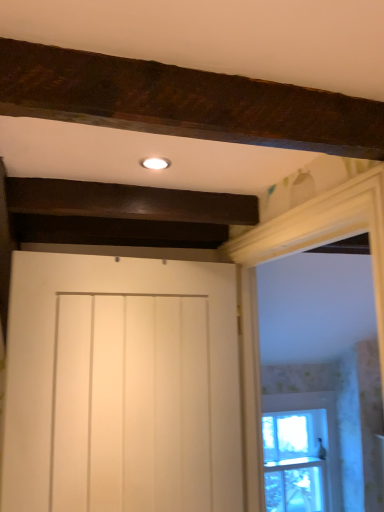
Find the location of `white matte door at center`. white matte door at center is located at coordinates (121, 385).

Where is `white wood frame at upper right`? white wood frame at upper right is located at coordinates (326, 231).

At what (x,y) coordinates should I click in order to perform the action: click on white matte door at center. Please return your answer as a coordinate pair (x, y). The width and height of the screenshot is (384, 512). Looking at the image, I should click on (121, 385).

Is clear glass window at right oriented towards white matte door at center?

No, clear glass window at right does not turn towards white matte door at center.

Does clear glass window at right touch white matte door at center?

No, clear glass window at right is not in contact with white matte door at center.

Is clear glass window at right positioned in front of white matte door at center?

No, it is behind white matte door at center.

Is clear glass window at right completely or partially outside of white wood frame at upper right?

Yes.

Can you confirm if clear glass window at right is taller than white wood frame at upper right?

No, clear glass window at right is not taller than white wood frame at upper right.

Is clear glass window at right wider than white wood frame at upper right?

No.

From the image's perspective, relative to clear glass window at right, is white wood frame at upper right above or below?

Based on their image positions, white wood frame at upper right is located above clear glass window at right.

Does white wood frame at upper right appear on the left side of clear glass window at right?

Yes, white wood frame at upper right is to the left of clear glass window at right.

Does point (305, 205) appear closer or farther from the camera than point (329, 402)?

Point (305, 205) is closer to the camera than point (329, 402).

Is the surface of white wood frame at upper right in direct contact with clear glass window at right?

No, white wood frame at upper right is not making contact with clear glass window at right.

Locate an element on the screen. window frame above the white matte door at center (from the image's perspective) is located at coordinates (326, 231).

Does white wood frame at upper right have a lesser height compared to white matte door at center?

Incorrect, the height of white wood frame at upper right does not fall short of that of white matte door at center.

Is white wood frame at upper right aimed at white matte door at center?

Yes.

Consider the image. Is white matte door at center directly adjacent to white wood frame at upper right?

No, white matte door at center is not in contact with white wood frame at upper right.

Does white matte door at center have a lesser height compared to white wood frame at upper right?

Correct, white matte door at center is not as tall as white wood frame at upper right.

Can you confirm if white matte door at center is thinner than white wood frame at upper right?

Indeed, white matte door at center has a lesser width compared to white wood frame at upper right.

Based on the photo, which is correct: white matte door at center is inside white wood frame at upper right, or outside of it?

The correct answer is: outside.

Which is more to the right, white matte door at center or clear glass window at right?

Positioned to the right is clear glass window at right.

From the image's perspective, is white matte door at center under clear glass window at right?

Actually, white matte door at center appears above clear glass window at right in the image.

Does white matte door at center lie behind clear glass window at right?

No, white matte door at center is in front of clear glass window at right.

Looking at this image, can we say white matte door at center lies outside clear glass window at right?

Yes, white matte door at center is outside of clear glass window at right.

The height and width of the screenshot is (512, 384). What are the coordinates of `window lying on the right of white matte door at center` in the screenshot? It's located at click(303, 446).

Locate an element on the screen. This screenshot has height=512, width=384. window frame to the left of clear glass window at right is located at coordinates (326, 231).

When comparing their distances from white matte door at center, does clear glass window at right or white wood frame at upper right seem closer?

The object closer to white matte door at center is white wood frame at upper right.

When comparing their distances from white matte door at center, does white wood frame at upper right or clear glass window at right seem closer?

white wood frame at upper right is closer to white matte door at center.

Which object lies further to the anchor point clear glass window at right, white matte door at center or white wood frame at upper right?

Among the two, white matte door at center is located further to clear glass window at right.

When comparing their distances from white wood frame at upper right, does white matte door at center or clear glass window at right seem further?

clear glass window at right is positioned further to the anchor white wood frame at upper right.

When comparing their distances from clear glass window at right, does white wood frame at upper right or white matte door at center seem further?

Based on the image, white matte door at center appears to be further to clear glass window at right.

Which object lies nearer to the anchor point white wood frame at upper right, clear glass window at right or white matte door at center?

white matte door at center is positioned closer to the anchor white wood frame at upper right.

This screenshot has height=512, width=384. Find the location of `door between white wood frame at upper right and clear glass window at right from front to back`. door between white wood frame at upper right and clear glass window at right from front to back is located at coordinates (121, 385).